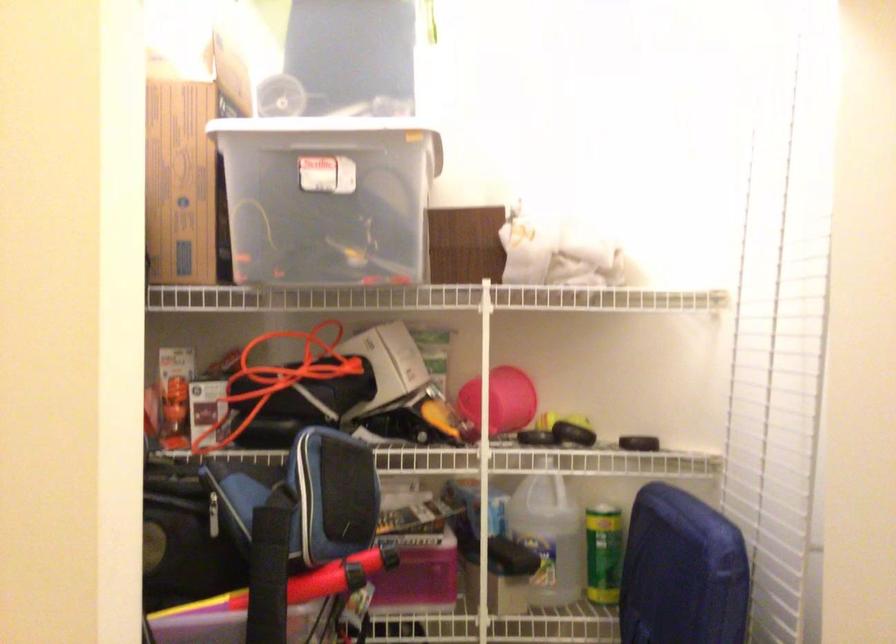
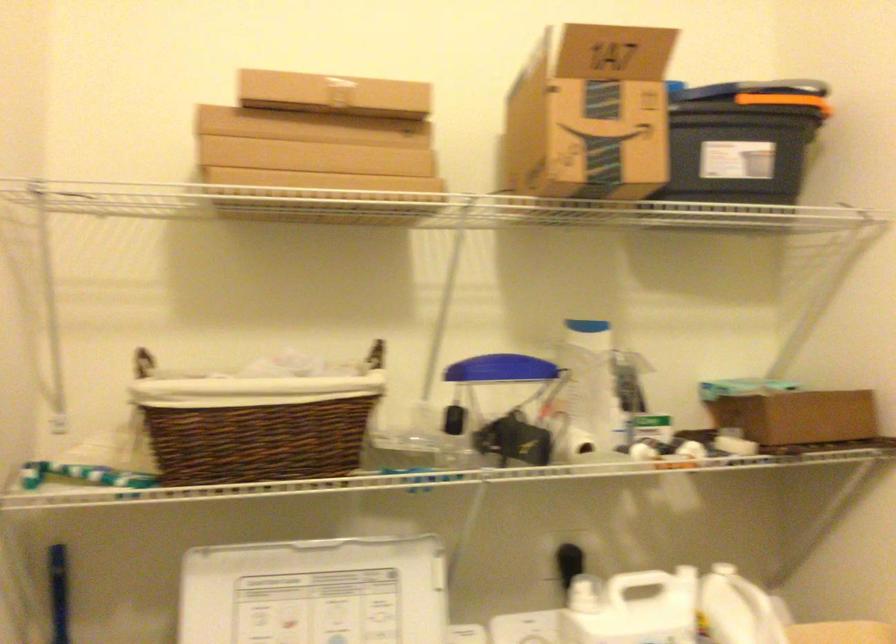
Question: The images are taken continuously from a first-person perspective. In which direction is your viewpoint rotating?

Choices:
 (A) Left
 (B) Right
 (C) Up
 (D) Down

Answer: (A)